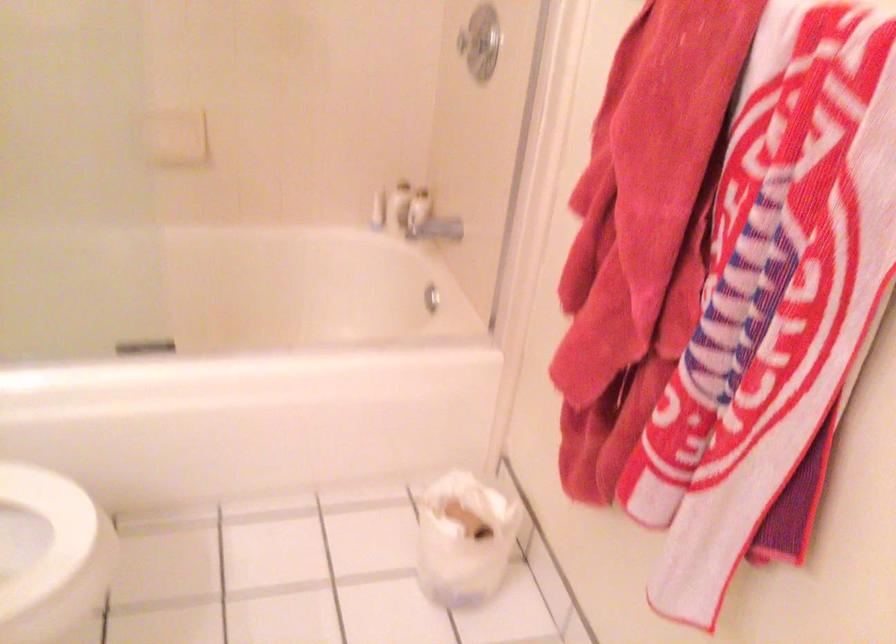
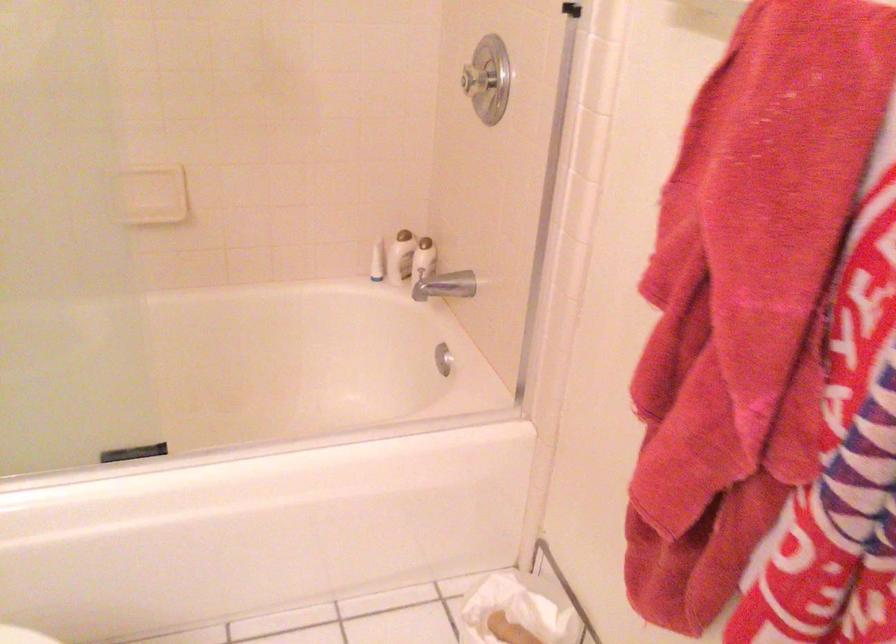
Question: Based on the continuous images, in which direction is the camera rotating? Reply with the corresponding letter.

Choices:
 (A) Left
 (B) Right
 (C) Up
 (D) Down

Answer: (C)